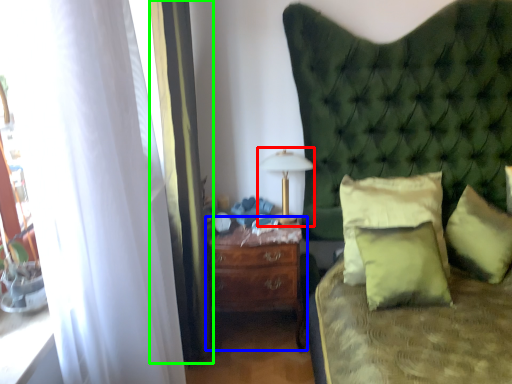
Question: Estimate the real-world distances between objects in this image. Which object is farther from bedside lamp (highlighted by a red box), nightstand (highlighted by a blue box) or curtain (highlighted by a green box)?

Choices:
 (A) nightstand
 (B) curtain

Answer: (B)